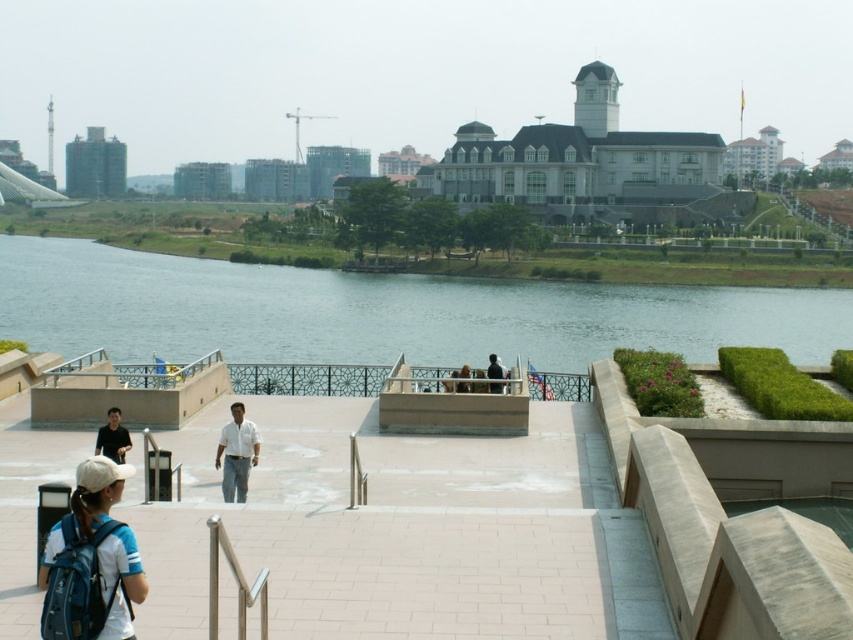
You are planning to place a new bench next to the light brown wooden bench at center. The new bench must be smaller than the existing one. Can the blue fabric backpack at lower left be used as a reference for the new bench size?

The blue fabric backpack at lower left is bigger than the light brown wooden bench at center. Therefore, using the backpack as a reference would result in a bench that is too large. You need to choose a smaller object for reference.

You are a photographer standing at the riverside. You want to take a photo that includes both the white matte shirt at center and the black matte shirt at lower left. Which person should you focus on first to ensure both are in the frame?

You should focus on the white matte shirt at center first because it is taller than the black matte shirt at lower left, so adjusting the camera angle to include its height will naturally include the shorter black matte shirt at lower left as well.